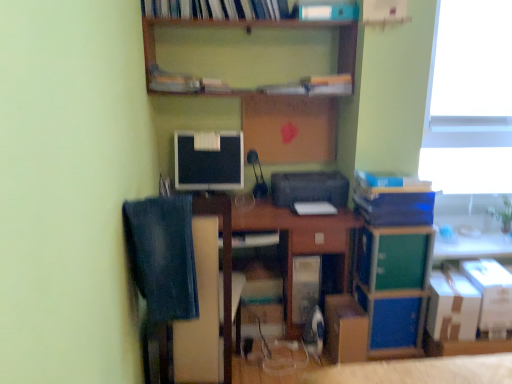
The height and width of the screenshot is (384, 512). What do you see at coordinates (282, 237) in the screenshot?
I see `wooden desk at center` at bounding box center [282, 237].

Describe the element at coordinates (209, 160) in the screenshot. I see `satin black monitor at center` at that location.

In order to face white cardboard box at lower right, positioned as the 2th cardboard box in left-to-right order, should I rotate leftwards or rightwards?

You should rotate right by 23.966 degrees.

The width and height of the screenshot is (512, 384). Identify the location of hardcover book at upper center, which is counted as the 4th book, starting from the bottom. (216, 9).

Find the location of a particular element. Image resolution: width=512 pixels, height=384 pixels. cardboard box at lower center, the first cardboard box in the left-to-right sequence is located at coordinates (345, 329).

The width and height of the screenshot is (512, 384). I want to click on black matte printer at center, so click(x=309, y=188).

Measure the distance between point (x=316, y=192) and camera.

They are 7.99 feet apart.

In order to face white plastic book at upper center, which ranks as the 3th book in right-to-left order, should I rotate leftwards or rightwards?

It's best to rotate right around 8.873 degrees.

Identify the location of wooden desk at center. This screenshot has height=384, width=512. (282, 237).

Is blue matte book at upper right, which appears as the second book when ordered from the bottom, in front of or behind black matte printer at center in the image?

In the image, blue matte book at upper right, which appears as the second book when ordered from the bottom, appears in front of black matte printer at center.

How far apart are blue matte book at upper right, acting as the third book starting from the top, and black matte printer at center?

blue matte book at upper right, acting as the third book starting from the top, and black matte printer at center are 10.77 inches apart from each other.

Can you confirm if blue matte book at upper right, the 1th book from the right, is thinner than black matte printer at center?

Yes, blue matte book at upper right, the 1th book from the right, is thinner than black matte printer at center.

Which is in front, point (468, 40) or point (262, 12)?

Point (262, 12)

At what (x,y) coordinates should I click in order to perform the action: click on book that is the 3rd object located in front of the white matte window screen at upper right. Please return your answer as a coordinate pair (x, y). The height and width of the screenshot is (384, 512). Looking at the image, I should click on (216, 9).

Can you confirm if white matte window screen at upper right is shorter than hardcover book at upper center, which is counted as the 4th book, starting from the bottom?

In fact, white matte window screen at upper right may be taller than hardcover book at upper center, which is counted as the 4th book, starting from the bottom.

This screenshot has height=384, width=512. What are the coordinates of `window screen that appears on the right of blue matte book at upper right, which appears as the second book when ordered from the bottom` in the screenshot? It's located at (469, 99).

Considering the relative sizes of white matte window screen at upper right and blue matte book at upper right, which appears as the second book when ordered from the bottom, in the image provided, is white matte window screen at upper right bigger than blue matte book at upper right, which appears as the second book when ordered from the bottom,?

Correct, white matte window screen at upper right is larger in size than blue matte book at upper right, which appears as the second book when ordered from the bottom.

Does white matte window screen at upper right have a lesser height compared to blue matte book at upper right, which appears as the second book when ordered from the bottom?

No.

Considering the relative positions of black matte printer at center and white matte window screen at upper right in the image provided, is black matte printer at center to the left or to the right of white matte window screen at upper right?

In the image, black matte printer at center appears on the left side of white matte window screen at upper right.

Which of these two, black matte printer at center or white matte window screen at upper right, is thinner?

white matte window screen at upper right is thinner.

In the image, is black matte printer at center positioned in front of or behind white matte window screen at upper right?

Clearly, black matte printer at center is in front of white matte window screen at upper right.

Does point (285, 180) come closer to viewer compared to point (478, 85)?

Yes, point (285, 180) is in front of point (478, 85).

Between blue matte book at upper right, marked as the 4th book in a left-to-right arrangement, and denim at left, which one has larger width?

denim at left is wider.

Can you confirm if blue matte book at upper right, the 1th book from the right, is bigger than denim at left?

Incorrect, blue matte book at upper right, the 1th book from the right, is not larger than denim at left.

From the image's perspective, is blue matte book at upper right, the 1th book from the right, located above or below denim at left?

blue matte book at upper right, the 1th book from the right, is above denim at left.

Is denim at left completely or partially inside blue matte book at upper right, marked as the 4th book in a left-to-right arrangement?

No, denim at left is not surrounded by blue matte book at upper right, marked as the 4th book in a left-to-right arrangement.

From a real-world perspective, who is located lower, green matte cabinet at lower right or satin black monitor at center?

From a 3D spatial view, green matte cabinet at lower right is below.

Between green matte cabinet at lower right and satin black monitor at center, which one has smaller width?

satin black monitor at center is thinner.

Could you tell me if green matte cabinet at lower right is turned towards satin black monitor at center?

No, green matte cabinet at lower right is not turned towards satin black monitor at center.

Is green matte cabinet at lower right in front of or behind satin black monitor at center in the image?

Clearly, green matte cabinet at lower right is in front of satin black monitor at center.

Looking at this image, considering the sizes of objects black matte printer at center and blue matte book at upper right, acting as the third book starting from the top, in the image provided, who is shorter, black matte printer at center or blue matte book at upper right, acting as the third book starting from the top,?

With less height is blue matte book at upper right, acting as the third book starting from the top.

From a real-world perspective, is black matte printer at center physically above blue matte book at upper right, acting as the third book starting from the top?

No.

Is black matte printer at center closer to camera compared to blue matte book at upper right, acting as the third book starting from the top?

That is False.

What's the angular difference between black matte printer at center and blue matte book at upper right, marked as the 4th book in a left-to-right arrangement,'s facing directions?

The angle between the facing direction of black matte printer at center and the facing direction of blue matte book at upper right, marked as the 4th book in a left-to-right arrangement, is 2.25 degrees.

Locate an element on the screen. the 1st book above the black matte printer at center (from the image's perspective) is located at coordinates (390, 180).

What are the coordinates of `the 4th book to the left of the white matte window screen at upper right, starting your count from the anchor` in the screenshot? It's located at (216, 9).

Based on their spatial positions, is blue matte book at upper right, which appears as the second book when ordered from the bottom, or white plastic book at upper center, which ranks as the 3th book in right-to-left order, further from white cardboard box at lower right, arranged as the first cardboard box when viewed from the right?

white plastic book at upper center, which ranks as the 3th book in right-to-left order, is further to white cardboard box at lower right, arranged as the first cardboard box when viewed from the right.

Looking at this image, which object lies further to the anchor point white cardboard box at lower right, placed as the 2th cardboard box when sorted from right to left, blue cardboard book at right, the second book positioned from the right, or satin black monitor at center?

The object further to white cardboard box at lower right, placed as the 2th cardboard box when sorted from right to left, is satin black monitor at center.

Based on their spatial positions, is wooden at upper center or cardboard box at lower center, the first cardboard box in the left-to-right sequence, closer to wooden desk at center?

Among the two, cardboard box at lower center, the first cardboard box in the left-to-right sequence, is located nearer to wooden desk at center.

Looking at the image, which one is located further to white matte window screen at upper right, blue matte book at upper right, which appears as the second book when ordered from the bottom, or white cardboard box at lower right, arranged as the first cardboard box when viewed from the right?

Based on the image, white cardboard box at lower right, arranged as the first cardboard box when viewed from the right, appears to be further to white matte window screen at upper right.

From the image, which object appears to be farther from white matte window screen at upper right, wooden at upper center or wooden desk at center?

Among the two, wooden desk at center is located further to white matte window screen at upper right.

Looking at the image, which one is located further to white matte window screen at upper right, blue cardboard book at right, the third book in the left-to-right sequence, or denim at left?

denim at left lies further to white matte window screen at upper right than the other object.

Considering their positions, is wooden desk at center positioned further to blue matte book at upper right, marked as the 4th book in a left-to-right arrangement, than hardcover book at upper center, which is counted as the 4th book, starting from the bottom?

hardcover book at upper center, which is counted as the 4th book, starting from the bottom, lies further to blue matte book at upper right, marked as the 4th book in a left-to-right arrangement, than the other object.

Based on their spatial positions, is hardcover book at upper center, the fourth book viewed from the right, or white cardboard box at lower right, arranged as the first cardboard box when viewed from the right, further from green matte cabinet at lower right?

hardcover book at upper center, the fourth book viewed from the right.

In order to click on cardboard box situated between wooden desk at center and green matte cabinet at lower right from left to right in this screenshot , I will do `click(345, 329)`.

You are a GUI agent. You are given a task and a screenshot of the screen. Output one action in this format:
    pyautogui.click(x=<x>, y=<y>)
    Task: Click on the computer desk between denim at left and white cardboard box at lower right, positioned as the 2th cardboard box in left-to-right order, in the horizontal direction
    
    Given the screenshot: What is the action you would take?
    pyautogui.click(x=282, y=237)

Identify the location of cabinet between black matte printer at center and cardboard box at lower center, the first cardboard box in the left-to-right sequence, in the up-down direction. Image resolution: width=512 pixels, height=384 pixels. (394, 257).

You are a GUI agent. You are given a task and a screenshot of the screen. Output one action in this format:
    pyautogui.click(x=<x>, y=<y>)
    Task: Click on the cardboard box between satin black monitor at center and green matte cabinet at lower right in the horizontal direction
    Image resolution: width=512 pixels, height=384 pixels.
    Given the screenshot: What is the action you would take?
    pyautogui.click(x=345, y=329)